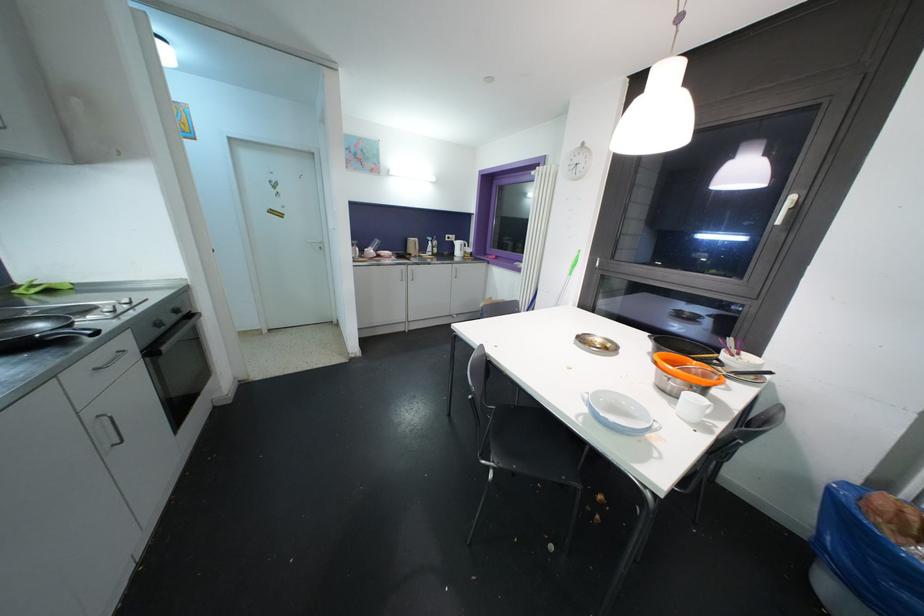
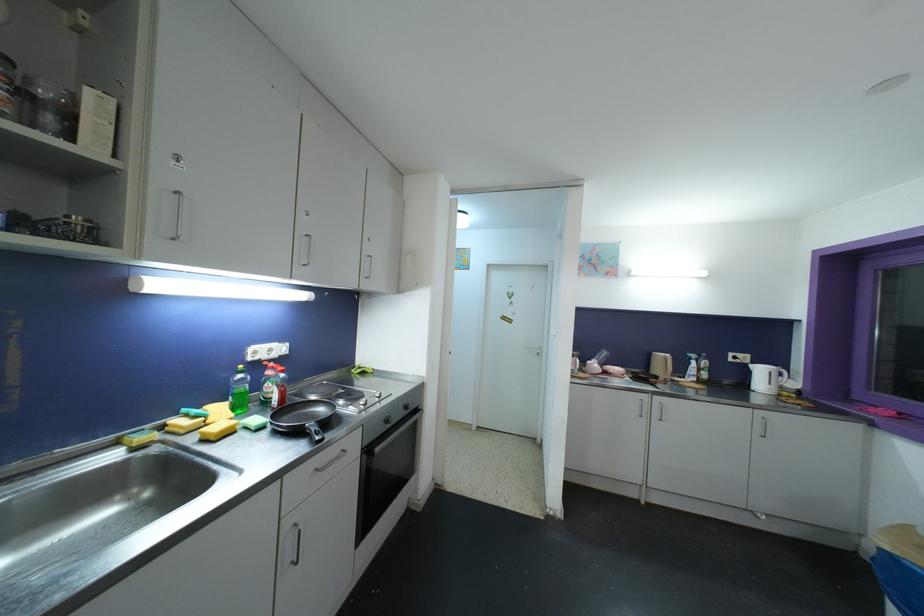
The point at (450,238) is marked in the first image. Where is the corresponding point in the second image?

(734, 357)